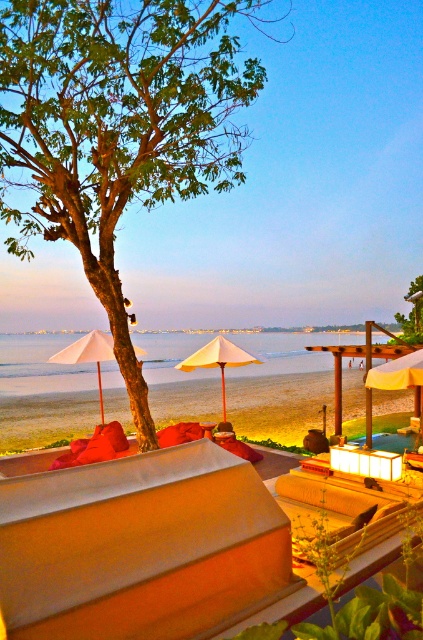
Question: Which is nearer to the green leafy tree at upper left?

Choices:
 (A) green leafy tree at center
 (B) clear water at beach center
 (C) beige fabric umbrella at center
 (D) white matte umbrella at left

Answer: (C)

Question: In this image, where is clear water at beach center located relative to white matte umbrella at left?

Choices:
 (A) left
 (B) right

Answer: (A)

Question: Is yellow fabric umbrella at center closer to the viewer compared to green leafy tree at upper left?

Choices:
 (A) no
 (B) yes

Answer: (B)

Question: Considering the real-world distances, which object is farthest from the green leafy tree at center?

Choices:
 (A) yellow fabric umbrella at center
 (B) beige fabric umbrella at center

Answer: (A)

Question: Does clear water at beach center have a larger size compared to beige fabric umbrella at center?

Choices:
 (A) yes
 (B) no

Answer: (A)

Question: Which object appears closest to the camera in this image?

Choices:
 (A) green leafy tree at center
 (B) clear water at beach center
 (C) beige fabric umbrella at center
 (D) white matte umbrella at left

Answer: (A)